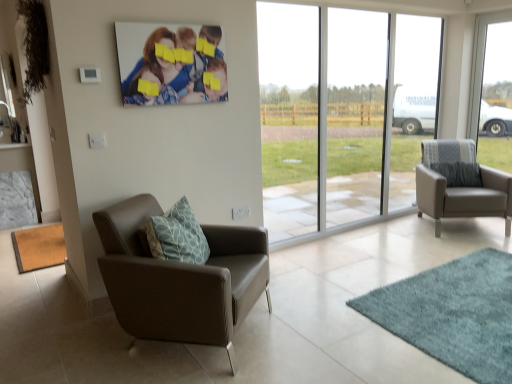
This screenshot has height=384, width=512. Find the location of `vacant space to the left of brown leather chair at left, the first chair positioned from the front`. vacant space to the left of brown leather chair at left, the first chair positioned from the front is located at coordinates (61, 336).